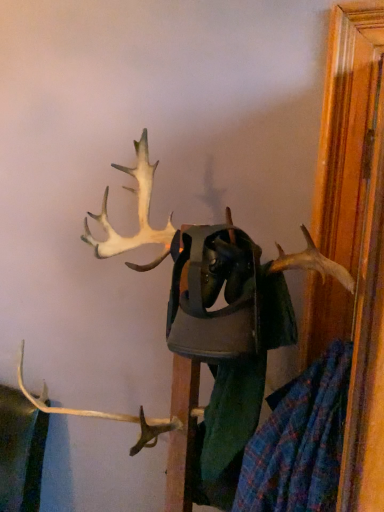
The height and width of the screenshot is (512, 384). Describe the element at coordinates (225, 347) in the screenshot. I see `plaid fabric shirt at center` at that location.

At what (x,y) coordinates should I click in order to perform the action: click on plaid fabric shirt at center. Please return your answer as a coordinate pair (x, y). Looking at the image, I should click on (225, 347).

What is the approximate height of white matte antlers at upper center?

white matte antlers at upper center is 3.59 feet in height.

What do you see at coordinates (220, 321) in the screenshot?
I see `white matte antlers at upper center` at bounding box center [220, 321].

At what (x,y) coordinates should I click in order to perform the action: click on white matte antlers at upper center. Please return your answer as a coordinate pair (x, y). Looking at the image, I should click on (220, 321).

I want to click on plaid fabric shirt at center, so click(225, 347).

Can you confirm if white matte antlers at upper center is positioned to the left of plaid fabric shirt at center?

Yes.

Which object is closer to the camera taking this photo, white matte antlers at upper center or plaid fabric shirt at center?

white matte antlers at upper center is closer to the camera.

Which is behind, point (274, 287) or point (268, 295)?

The point (268, 295) is farther.

Based on the photo, from the image's perspective, would you say white matte antlers at upper center is shown under plaid fabric shirt at center?

Actually, white matte antlers at upper center appears above plaid fabric shirt at center in the image.

From a real-world perspective, is white matte antlers at upper center physically located above or below plaid fabric shirt at center?

Clearly, from a real-world perspective, white matte antlers at upper center is above plaid fabric shirt at center.

Considering the sizes of white matte antlers at upper center and plaid fabric shirt at center in the image, is white matte antlers at upper center wider or thinner than plaid fabric shirt at center?

In the image, white matte antlers at upper center appears to be wider than plaid fabric shirt at center.

Can you confirm if white matte antlers at upper center is taller than plaid fabric shirt at center?

Indeed, white matte antlers at upper center has a greater height compared to plaid fabric shirt at center.

Who is bigger, white matte antlers at upper center or plaid fabric shirt at center?

white matte antlers at upper center.

Is white matte antlers at upper center inside the boundaries of plaid fabric shirt at center, or outside?

white matte antlers at upper center is not enclosed by plaid fabric shirt at center.

Is the surface of white matte antlers at upper center in direct contact with plaid fabric shirt at center?

Absolutely, white matte antlers at upper center is next to and touching plaid fabric shirt at center.

Is white matte antlers at upper center oriented towards plaid fabric shirt at center?

Yes, white matte antlers at upper center is aimed at plaid fabric shirt at center.

Can you tell me how much white matte antlers at upper center and plaid fabric shirt at center differ in facing direction?

0.00117 degrees.

What are the coordinates of `deer above the plaid fabric shirt at center (from a real-world perspective)` in the screenshot? It's located at point(220,321).

Would you say plaid fabric shirt at center is to the left or to the right of white matte antlers at upper center in the picture?

plaid fabric shirt at center is positioned on white matte antlers at upper center's right side.

Which object is further away from the camera, plaid fabric shirt at center or white matte antlers at upper center?

plaid fabric shirt at center.

Which is nearer, (x=173, y=275) or (x=277, y=277)?

Point (x=277, y=277)

From the image's perspective, which is below, plaid fabric shirt at center or white matte antlers at upper center?

plaid fabric shirt at center.

From a real-world perspective, is plaid fabric shirt at center located higher than white matte antlers at upper center?

Actually, plaid fabric shirt at center is physically below white matte antlers at upper center in the real world.

Which object is thinner, plaid fabric shirt at center or white matte antlers at upper center?

Thinner between the two is plaid fabric shirt at center.

Between plaid fabric shirt at center and white matte antlers at upper center, which one has less height?

plaid fabric shirt at center.

Considering the sizes of objects plaid fabric shirt at center and white matte antlers at upper center in the image provided, who is bigger, plaid fabric shirt at center or white matte antlers at upper center?

white matte antlers at upper center.

Is white matte antlers at upper center inside plaid fabric shirt at center?

No, plaid fabric shirt at center does not contain white matte antlers at upper center.

Are plaid fabric shirt at center and white matte antlers at upper center making contact?

Yes, plaid fabric shirt at center and white matte antlers at upper center clearly make contact.

Is plaid fabric shirt at center oriented towards white matte antlers at upper center?

Yes, plaid fabric shirt at center faces towards white matte antlers at upper center.

I want to click on deer above the plaid fabric shirt at center (from a real-world perspective), so click(220, 321).

I want to click on deer above the plaid fabric shirt at center (from a real-world perspective), so 220,321.

Where is `clothing below the white matte antlers at upper center (from the image's perspective)`? The width and height of the screenshot is (384, 512). clothing below the white matte antlers at upper center (from the image's perspective) is located at coordinates (225, 347).